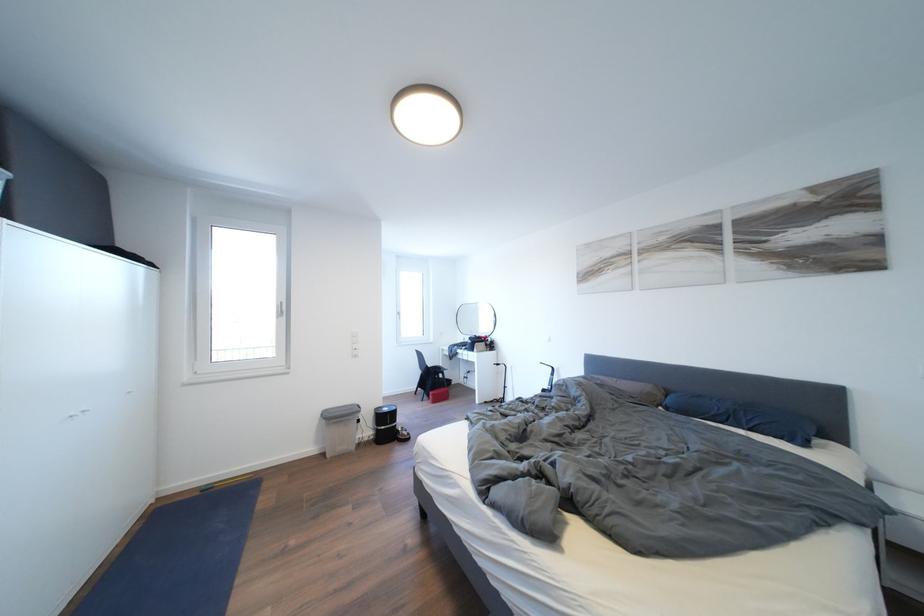
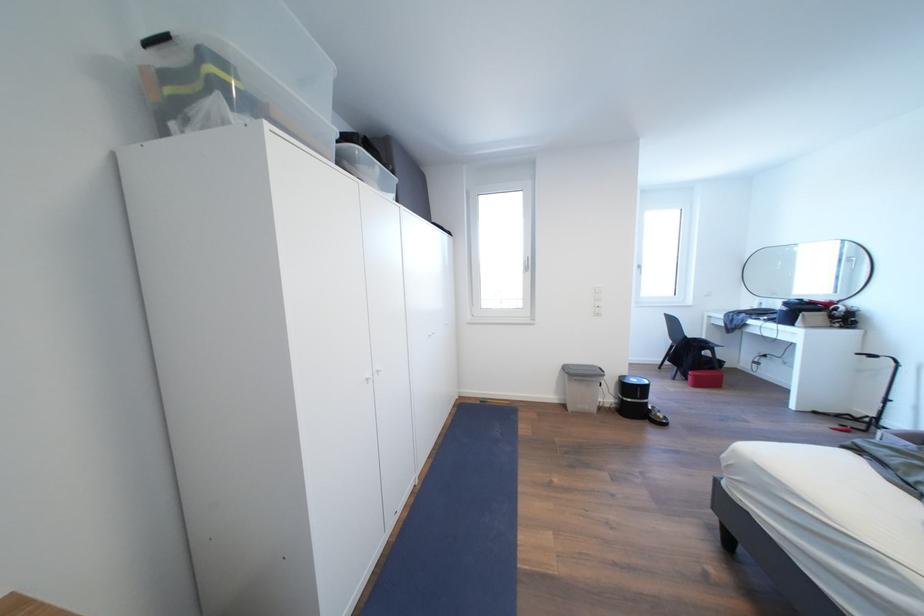
Where in the second image is the point corresponding to (x=441, y=400) from the first image?

(703, 381)